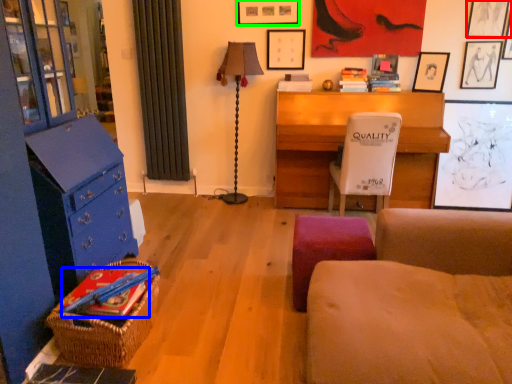
Question: Which is nearer to the picture frame (highlighted by a red box)? book (highlighted by a blue box) or picture frame (highlighted by a green box).

Choices:
 (A) book
 (B) picture frame

Answer: (B)